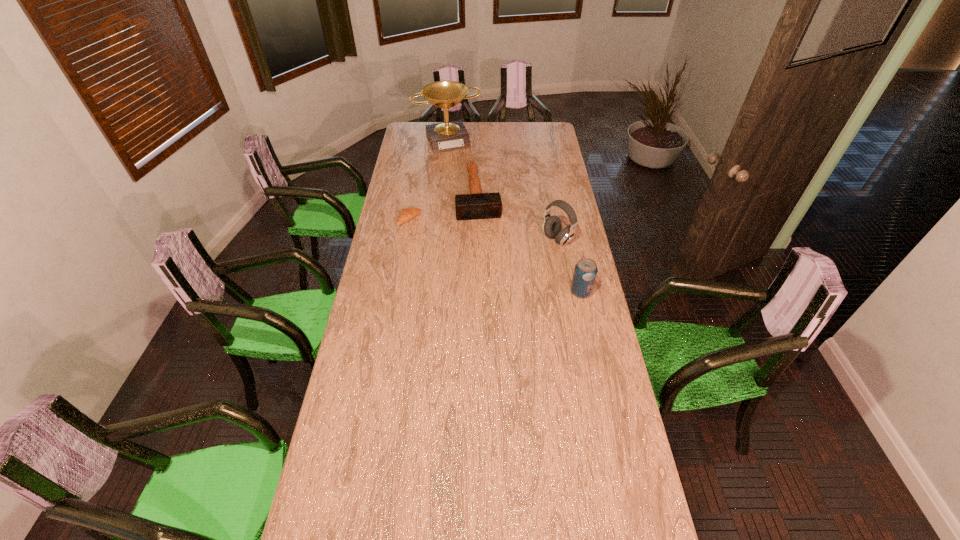
Locate an element on the screen. The image size is (960, 540). crescent roll situated at the left edge is located at coordinates (407, 214).

The width and height of the screenshot is (960, 540). Identify the location of award that is at the left edge. (448, 136).

Where is `pop soda situated at the right edge`? The image size is (960, 540). pop soda situated at the right edge is located at coordinates (585, 271).

This screenshot has width=960, height=540. Identify the location of headset present at the right edge. (552, 225).

In order to click on object that is at the far left corner in this screenshot , I will do `click(448, 136)`.

Locate an element on the screen. The width and height of the screenshot is (960, 540). vacant space at the far edge is located at coordinates (523, 123).

Locate an element on the screen. The height and width of the screenshot is (540, 960). vacant area at the left edge of the desktop is located at coordinates (415, 176).

In the image, there is a desktop. At what (x,y) coordinates should I click in order to perform the action: click on free space at the right edge. Please return your answer as a coordinate pair (x, y). This screenshot has height=540, width=960. Looking at the image, I should click on (568, 191).

This screenshot has width=960, height=540. In order to click on free spot between the second tallest object and the nearest object in this screenshot , I will do `click(569, 266)`.

Identify the location of free space that is in between the shortest object and the fourth farthest object. (484, 229).